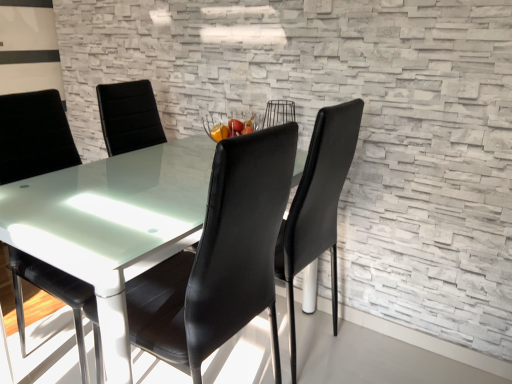
Question: Does black leather chair at left, the first chair in the left-to-right sequence, have a lesser width compared to black leather chair at center, the 2th chair when ordered from left to right?

Choices:
 (A) no
 (B) yes

Answer: (A)

Question: Does black leather chair at left, positioned as the second chair in right-to-left order, have a smaller size compared to black leather chair at center, which appears as the 1th chair when viewed from the right?

Choices:
 (A) yes
 (B) no

Answer: (B)

Question: Does black leather chair at left, the first chair in the left-to-right sequence, touch black leather chair at center, the 2th chair when ordered from left to right?

Choices:
 (A) no
 (B) yes

Answer: (A)

Question: Considering the relative sizes of black leather chair at left, positioned as the second chair in right-to-left order, and black leather chair at center, the 2th chair when ordered from left to right, in the image provided, is black leather chair at left, positioned as the second chair in right-to-left order, taller than black leather chair at center, the 2th chair when ordered from left to right,?

Choices:
 (A) no
 (B) yes

Answer: (A)

Question: From a real-world perspective, is black leather chair at left, positioned as the second chair in right-to-left order, positioned over black leather chair at center, the 2th chair when ordered from left to right, based on gravity?

Choices:
 (A) yes
 (B) no

Answer: (B)

Question: Is black leather chair at left, the first chair in the left-to-right sequence, further to the viewer compared to black leather chair at center, the 2th chair when ordered from left to right?

Choices:
 (A) no
 (B) yes

Answer: (B)

Question: Is black leather chair at center, the 2th chair when ordered from left to right, oriented towards black leather chair at left, the first chair in the left-to-right sequence?

Choices:
 (A) yes
 (B) no

Answer: (A)

Question: Is black leather chair at center, the 2th chair when ordered from left to right, bigger than black leather chair at left, positioned as the second chair in right-to-left order?

Choices:
 (A) yes
 (B) no

Answer: (B)

Question: Can you confirm if black leather chair at center, which appears as the 1th chair when viewed from the right, is thinner than black leather chair at left, the first chair in the left-to-right sequence?

Choices:
 (A) no
 (B) yes

Answer: (B)

Question: Can you confirm if black leather chair at center, which appears as the 1th chair when viewed from the right, is positioned to the right of black leather chair at left, positioned as the second chair in right-to-left order?

Choices:
 (A) no
 (B) yes

Answer: (B)

Question: Considering the relative sizes of black leather chair at center, the 2th chair when ordered from left to right, and black leather chair at left, positioned as the second chair in right-to-left order, in the image provided, is black leather chair at center, the 2th chair when ordered from left to right, taller than black leather chair at left, positioned as the second chair in right-to-left order,?

Choices:
 (A) no
 (B) yes

Answer: (B)

Question: From the image's perspective, is black leather chair at center, the 2th chair when ordered from left to right, on top of black leather chair at left, the first chair in the left-to-right sequence?

Choices:
 (A) no
 (B) yes

Answer: (A)

Question: Is black leather chair at left, positioned as the second chair in right-to-left order, inside or outside of black leather chair at center, the 2th chair when ordered from left to right?

Choices:
 (A) outside
 (B) inside

Answer: (A)